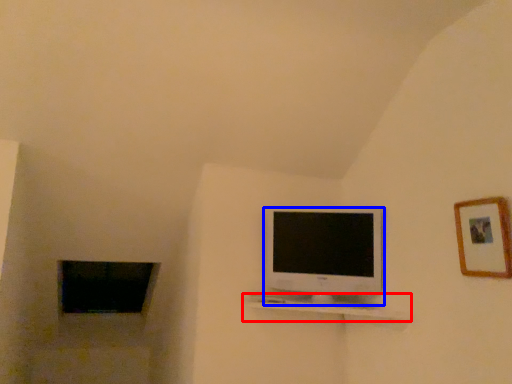
Question: Which object appears closest to the camera in this image, shelf (highlighted by a red box) or television (highlighted by a blue box)?

Choices:
 (A) shelf
 (B) television

Answer: (A)